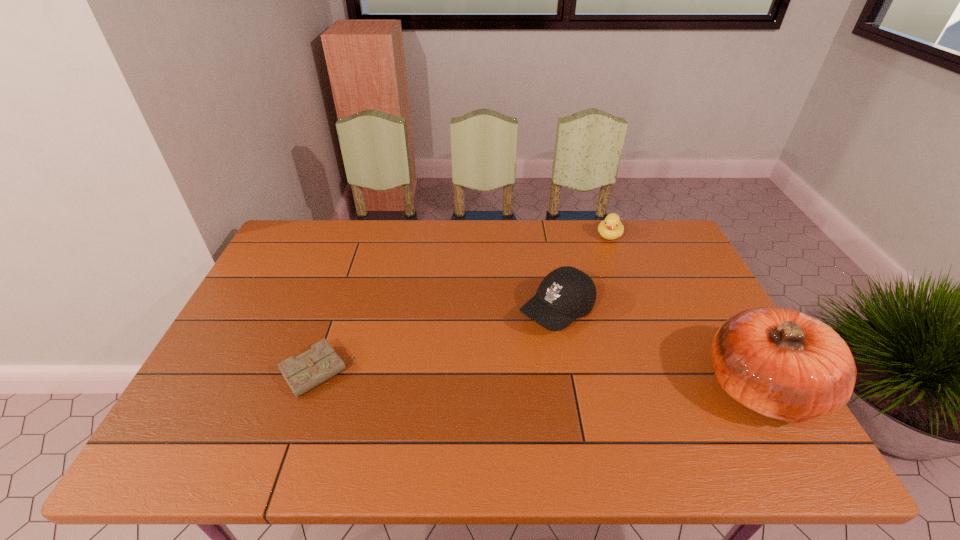
This screenshot has width=960, height=540. Identify the location of free point that satisfies the following two spatial constraints: 1. on the front side of the tallest object; 2. on the right side of the third object from right to left. (570, 387).

The image size is (960, 540). In order to click on vacant space that satisfies the following two spatial constraints: 1. on the back side of the diary; 2. on the left side of the third nearest object in this screenshot , I will do `click(338, 312)`.

Find the location of a particular element. The width and height of the screenshot is (960, 540). free space that satisfies the following two spatial constraints: 1. on the front side of the pumpkin; 2. on the left side of the farthest object is located at coordinates coord(666,387).

In order to click on vacant position in the image that satisfies the following two spatial constraints: 1. on the back side of the third object from left to right; 2. on the left side of the second tallest object in this screenshot , I will do `click(543, 235)`.

Locate an element on the screen. This screenshot has width=960, height=540. vacant region that satisfies the following two spatial constraints: 1. on the front side of the tallest object; 2. on the left side of the third object from left to right is located at coordinates (666, 387).

Where is `vacant space that satisfies the following two spatial constraints: 1. on the front side of the tallest object; 2. on the right side of the duckling`? The image size is (960, 540). vacant space that satisfies the following two spatial constraints: 1. on the front side of the tallest object; 2. on the right side of the duckling is located at coordinates (666, 387).